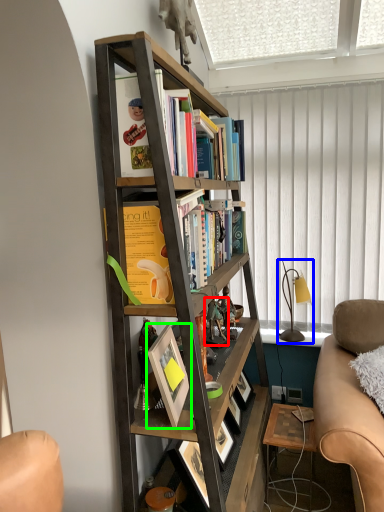
Question: Considering the real-world distances, which object is farthest from toy (highlighted by a red box)? table lamp (highlighted by a blue box) or picture frame (highlighted by a green box)?

Choices:
 (A) table lamp
 (B) picture frame

Answer: (A)